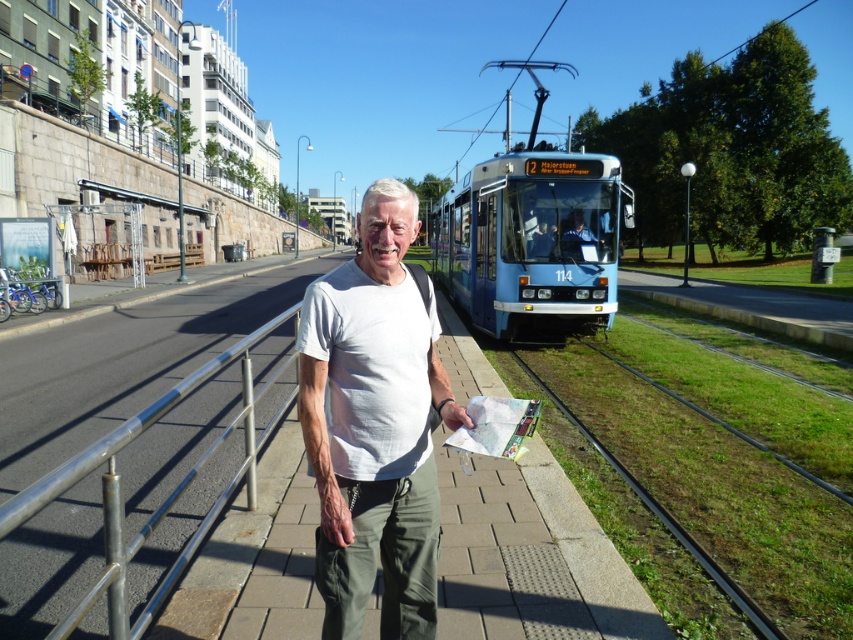
Question: Can you confirm if silver metallic rail at center is positioned to the left of white cotton t-shirt at center?

Choices:
 (A) yes
 (B) no

Answer: (A)

Question: Can you confirm if silver metallic rail at center is positioned to the right of white cotton t-shirt at center?

Choices:
 (A) yes
 (B) no

Answer: (B)

Question: Which point is closer to the camera?

Choices:
 (A) silver metallic rail at center
 (B) white cotton t-shirt at center

Answer: (A)

Question: Observing the image, what is the correct spatial positioning of silver metallic rail at center in reference to white cotton t-shirt at center?

Choices:
 (A) right
 (B) left

Answer: (B)